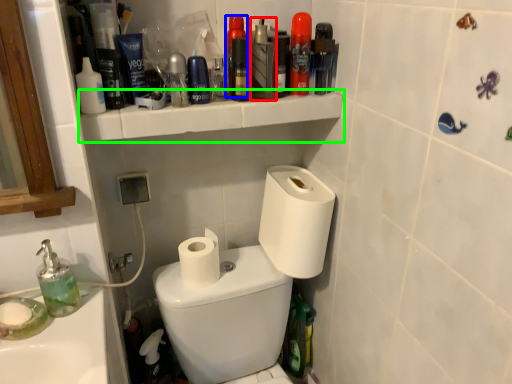
Question: Which object is the farthest from mouthwash (highlighted by a red box)? Choose among these: mouthwash (highlighted by a blue box) or shelve (highlighted by a green box).

Choices:
 (A) mouthwash
 (B) shelve

Answer: (B)